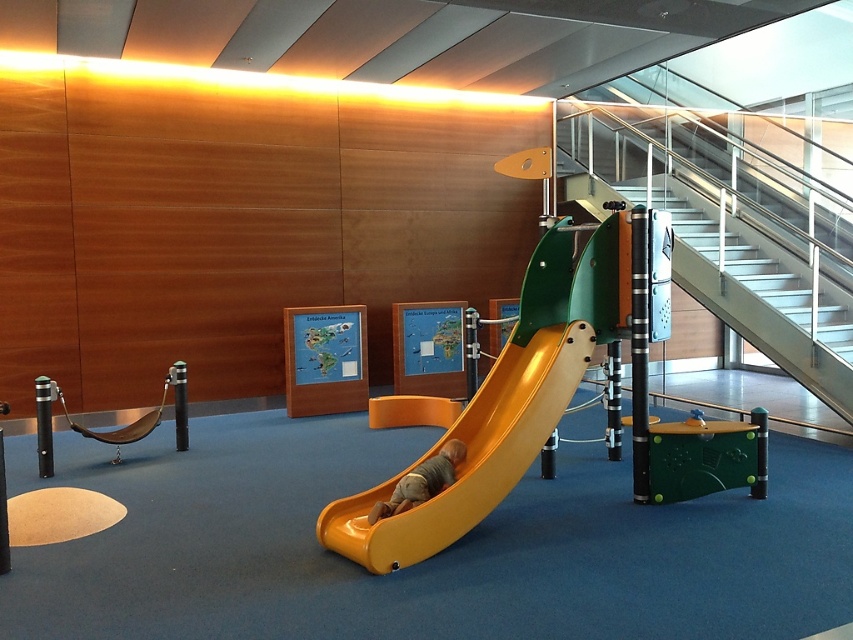
Question: Which point is closer to the camera?

Choices:
 (A) (463, 454)
 (B) (746, 250)

Answer: (A)

Question: Can you confirm if yellow matte slide at center is positioned below smooth yellow slide at center?

Choices:
 (A) no
 (B) yes

Answer: (A)

Question: Is yellow matte slide at center behind metallic silver stairs at upper right?

Choices:
 (A) no
 (B) yes

Answer: (A)

Question: Is yellow matte slide at center closer to camera compared to metallic silver stairs at upper right?

Choices:
 (A) yes
 (B) no

Answer: (A)

Question: Among these points, which one is farthest from the camera?

Choices:
 (A) (846, 348)
 (B) (486, 417)
 (C) (392, 502)

Answer: (A)

Question: Which of the following is the farthest from the observer?

Choices:
 (A) (801, 307)
 (B) (372, 552)
 (C) (410, 484)

Answer: (A)